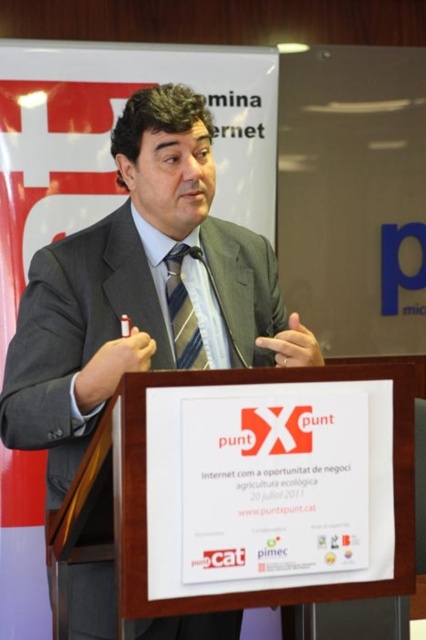
Question: Which of the following is the farthest from the observer?

Choices:
 (A) (75, 307)
 (B) (183, 365)

Answer: (B)

Question: Which point appears farthest from the camera in this image?

Choices:
 (A) (169, 310)
 (B) (256, 330)

Answer: (B)

Question: Is gray suit at center positioned behind striped fabric tie at center?

Choices:
 (A) yes
 (B) no

Answer: (B)

Question: In this image, where is gray suit at center located relative to striped fabric tie at center?

Choices:
 (A) left
 (B) right

Answer: (A)

Question: Is gray suit at center bigger than striped fabric tie at center?

Choices:
 (A) no
 (B) yes

Answer: (B)